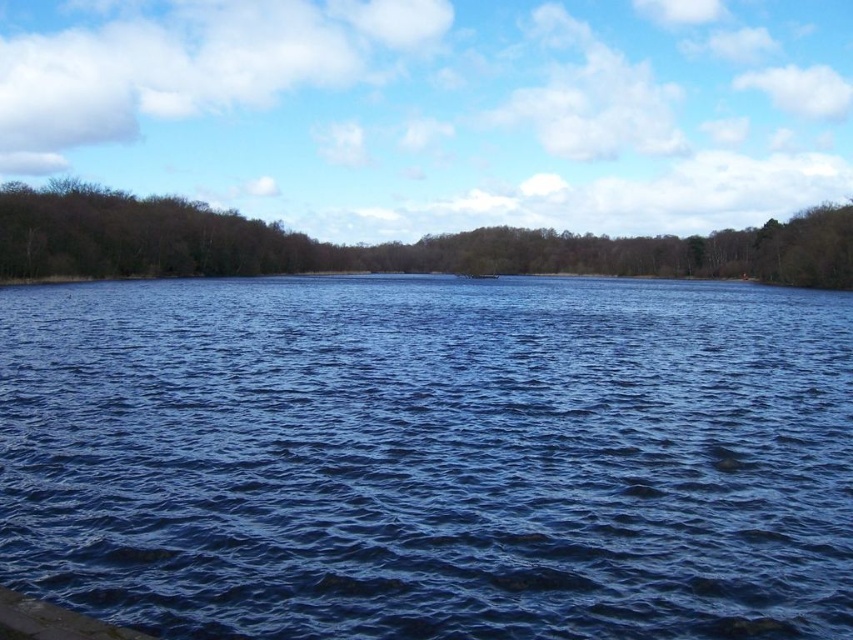
Question: Among these points, which one is nearest to the camera?

Choices:
 (A) (308, 426)
 (B) (238, 248)

Answer: (A)

Question: Which point is farther to the camera?

Choices:
 (A) brown/dry wood trees at upper left
 (B) blue liquid water at center

Answer: (A)

Question: Does blue liquid water at center have a lesser width compared to brown/dry wood trees at upper left?

Choices:
 (A) no
 (B) yes

Answer: (B)

Question: In this image, where is blue liquid water at center located relative to brown/dry wood trees at upper left?

Choices:
 (A) right
 (B) left

Answer: (B)

Question: Can you confirm if blue liquid water at center is smaller than brown/dry wood trees at upper left?

Choices:
 (A) yes
 (B) no

Answer: (A)